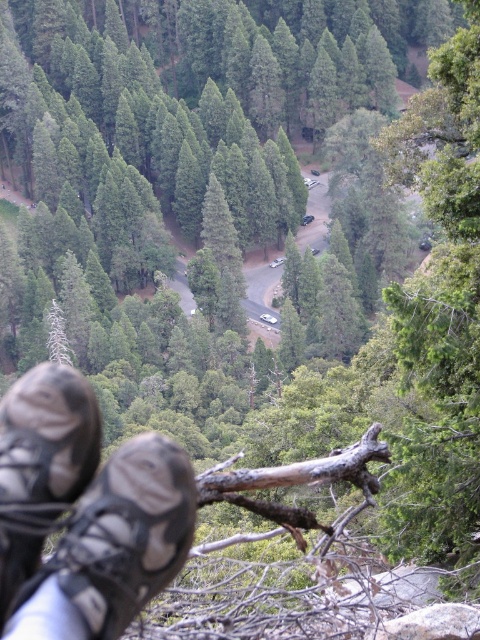
In the scene shown: Does black mesh shoe at lower left appear on the left side of black suede shoe at lower left?

In fact, black mesh shoe at lower left is to the right of black suede shoe at lower left.

Can you confirm if black mesh shoe at lower left is bigger than black suede shoe at lower left?

Yes.

This screenshot has width=480, height=640. I want to click on black mesh shoe at lower left, so click(115, 545).

At what (x,y) coordinates should I click in order to perform the action: click on black mesh shoe at lower left. Please return your answer as a coordinate pair (x, y). The height and width of the screenshot is (640, 480). Looking at the image, I should click on (115, 545).